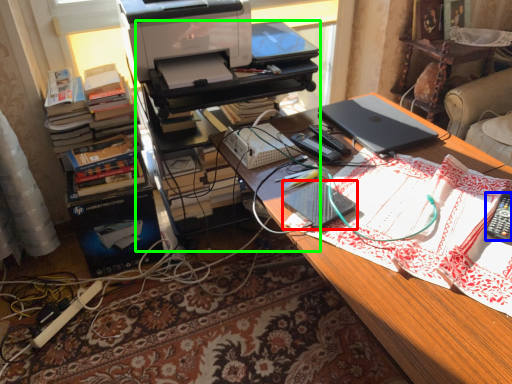
Question: Which object is the farthest from notebook (highlighted by a red box)? Choose among these: remote control (highlighted by a blue box) or computer desk (highlighted by a green box).

Choices:
 (A) remote control
 (B) computer desk

Answer: (B)